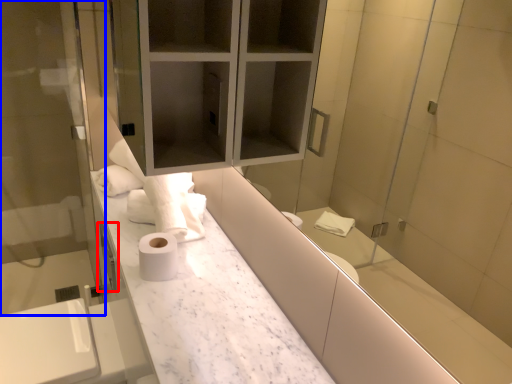
Question: Which of the following is the farthest to the observer, faucet (highlighted by a red box) or screen door (highlighted by a blue box)?

Choices:
 (A) faucet
 (B) screen door

Answer: (A)